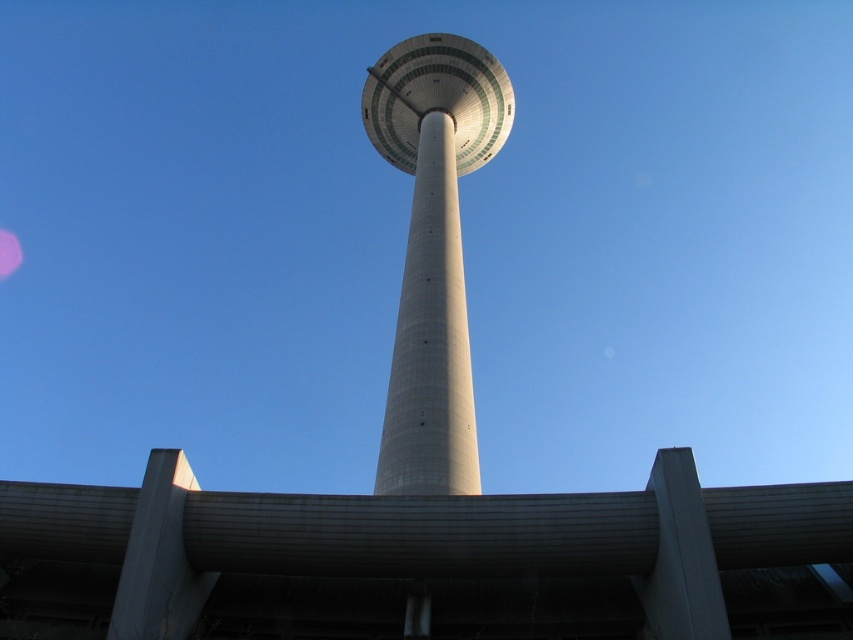
Based on the photo, does concrete at center have a greater height compared to white concrete tower at center?

No.

Looking at this image, is concrete at center below white concrete tower at center?

Yes.

Is point (403, 595) behind point (433, 332)?

No, (403, 595) is closer to viewer.

Locate an element on the screen. concrete at center is located at coordinates (x=425, y=561).

Who is more forward, (413, 328) or (367, 88)?

Point (413, 328)

Who is higher up, white concrete tower at center or smooth concrete tower at center?

smooth concrete tower at center is above.

Is point (450, 134) farther from camera compared to point (474, 113)?

No, it is not.

Find the location of a particular element. white concrete tower at center is located at coordinates (433, 250).

From the picture: Between concrete at center and smooth concrete tower at center, which one appears on the left side from the viewer's perspective?

concrete at center

Is concrete at center bigger than smooth concrete tower at center?

Actually, concrete at center might be smaller than smooth concrete tower at center.

Image resolution: width=853 pixels, height=640 pixels. What are the coordinates of `concrete at center` in the screenshot? It's located at (425, 561).